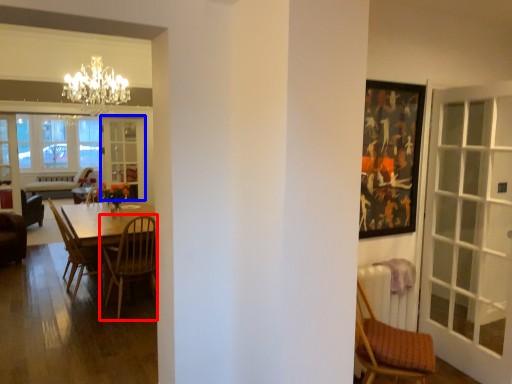
Question: Among these objects, which one is farthest to the camera, chair (highlighted by a red box) or screen door (highlighted by a blue box)?

Choices:
 (A) chair
 (B) screen door

Answer: (B)